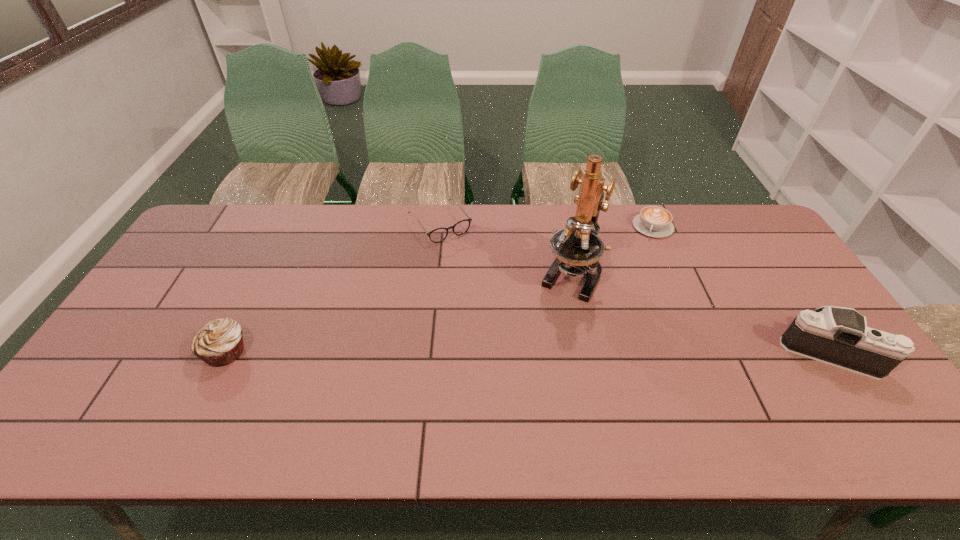
The width and height of the screenshot is (960, 540). I want to click on vacant space situated at the eyepiece of the microscope, so click(521, 373).

Where is `free space located at the eyepiece of the microscope`? The height and width of the screenshot is (540, 960). free space located at the eyepiece of the microscope is located at coordinates (542, 334).

You are a GUI agent. You are given a task and a screenshot of the screen. Output one action in this format:
    pyautogui.click(x=<x>, y=<y>)
    Task: Click on the vacant space located at the eyepiece of the microscope
    
    Given the screenshot: What is the action you would take?
    pyautogui.click(x=515, y=386)

The height and width of the screenshot is (540, 960). What are the coordinates of `free region located through the lenses of the spectacles` in the screenshot? It's located at (472, 267).

At what (x,y) coordinates should I click in order to perform the action: click on vacant space located 0.380m through the lenses of the spectacles. Please return your answer as a coordinate pair (x, y). The height and width of the screenshot is (540, 960). Looking at the image, I should click on (515, 322).

This screenshot has height=540, width=960. What are the coordinates of `vacant space located 0.300m through the lenses of the spectacles` in the screenshot? It's located at (500, 303).

The width and height of the screenshot is (960, 540). Identify the location of free space located 0.380m on the side of the second object from right to left with the handle. (618, 316).

Image resolution: width=960 pixels, height=540 pixels. What are the coordinates of `vacant space located on the side of the second object from right to left with the handle` in the screenshot? It's located at (634, 275).

At what (x,y) coordinates should I click in order to perform the action: click on vacant region located on the side of the second object from right to left with the handle. Please return your answer as a coordinate pair (x, y). The width and height of the screenshot is (960, 540). Looking at the image, I should click on (627, 293).

This screenshot has height=540, width=960. I want to click on microscope that is positioned at the far edge, so click(x=577, y=248).